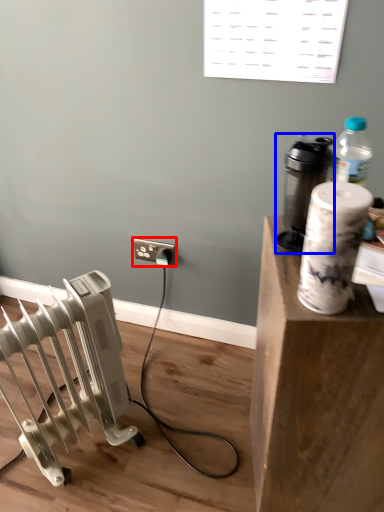
Question: Which point is closer to the camera, electric outlet (highlighted by a red box) or appliance (highlighted by a blue box)?

Choices:
 (A) electric outlet
 (B) appliance

Answer: (B)